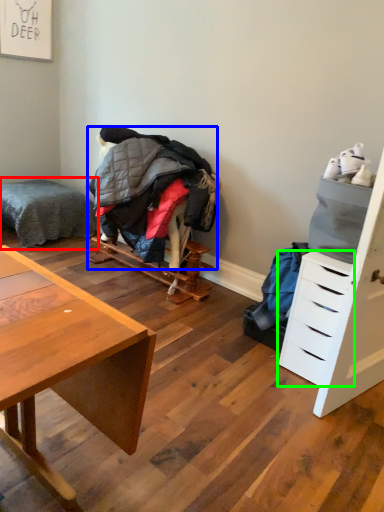
Question: Which object is positioned farthest from bed (highlighted by a red box)? Select from clothing (highlighted by a blue box) and drawer (highlighted by a green box).

Choices:
 (A) clothing
 (B) drawer

Answer: (B)